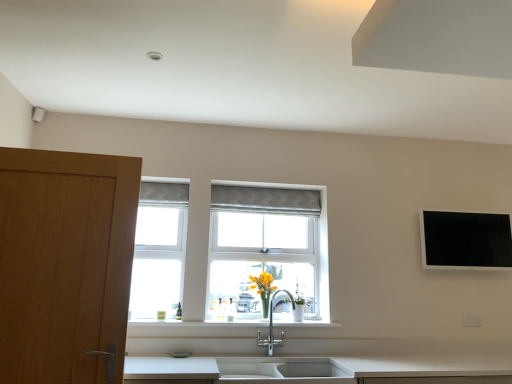
Question: Is white plastic electric outlet at lower right taller than textured gray curtain at center?

Choices:
 (A) no
 (B) yes

Answer: (A)

Question: Could textured gray curtain at center be considered to be inside white plastic electric outlet at lower right?

Choices:
 (A) no
 (B) yes

Answer: (A)

Question: From the image's perspective, is white plastic electric outlet at lower right on top of textured gray curtain at center?

Choices:
 (A) no
 (B) yes

Answer: (A)

Question: Is white plastic electric outlet at lower right next to textured gray curtain at center?

Choices:
 (A) yes
 (B) no

Answer: (B)

Question: Is white plastic electric outlet at lower right facing towards textured gray curtain at center?

Choices:
 (A) no
 (B) yes

Answer: (A)

Question: Relative to white plastic window frame at left, is white ceramic sink at lower center in front or behind?

Choices:
 (A) front
 (B) behind

Answer: (A)

Question: Choose the correct answer: Is white ceramic sink at lower center inside white plastic window frame at left or outside it?

Choices:
 (A) outside
 (B) inside

Answer: (A)

Question: Is white ceramic sink at lower center to the left or to the right of white plastic window frame at left in the image?

Choices:
 (A) right
 (B) left

Answer: (A)

Question: Is white ceramic sink at lower center taller or shorter than white plastic window frame at left?

Choices:
 (A) short
 (B) tall

Answer: (A)

Question: Would you say white plastic electric outlet at lower right is to the left or to the right of wooden door at left in the picture?

Choices:
 (A) right
 (B) left

Answer: (A)

Question: Considering the positions of white plastic electric outlet at lower right and wooden door at left in the image, is white plastic electric outlet at lower right wider or thinner than wooden door at left?

Choices:
 (A) thin
 (B) wide

Answer: (A)

Question: Is white plastic electric outlet at lower right in front of or behind wooden door at left in the image?

Choices:
 (A) front
 (B) behind

Answer: (B)

Question: Is white plastic electric outlet at lower right situated inside wooden door at left or outside?

Choices:
 (A) inside
 (B) outside

Answer: (B)

Question: Based on their sizes in the image, would you say white ceramic sink at lower center is bigger or smaller than black glossy flat screen tv at upper right?

Choices:
 (A) small
 (B) big

Answer: (B)

Question: Is white ceramic sink at lower center in front of or behind black glossy flat screen tv at upper right in the image?

Choices:
 (A) behind
 (B) front

Answer: (B)